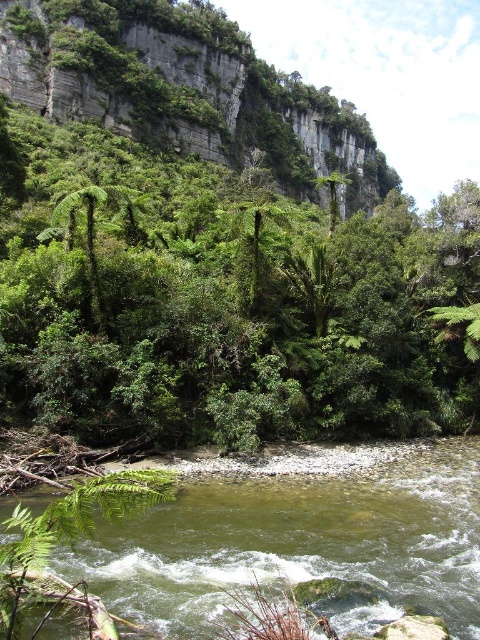
Consider the image. Can you confirm if green leafy tree at center is bigger than green smooth water at center?

Indeed, green leafy tree at center has a larger size compared to green smooth water at center.

Between point (361, 275) and point (123, 548), which one is positioned in front?

Positioned in front is point (123, 548).

Which is in front, point (39, 289) or point (312, 477)?

Point (312, 477) is in front.

I want to click on green leafy tree at center, so click(227, 307).

Can you confirm if green leafy tree at center is positioned below green leafy hillside at upper left?

Indeed, green leafy tree at center is positioned under green leafy hillside at upper left.

Between green leafy tree at center and green leafy hillside at upper left, which one appears on the left side from the viewer's perspective?

From the viewer's perspective, green leafy tree at center appears more on the left side.

This screenshot has height=640, width=480. What do you see at coordinates (227, 307) in the screenshot?
I see `green leafy tree at center` at bounding box center [227, 307].

At what (x,y) coordinates should I click in order to perform the action: click on green leafy tree at center. Please return your answer as a coordinate pair (x, y). This screenshot has width=480, height=640. Looking at the image, I should click on (227, 307).

Which of these two, green smooth water at center or green leafy hillside at upper left, stands taller?

green leafy hillside at upper left is taller.

Based on the photo, is green smooth water at center bigger than green leafy hillside at upper left?

Incorrect, green smooth water at center is not larger than green leafy hillside at upper left.

Which is behind, point (93, 545) or point (92, 77)?

Positioned behind is point (92, 77).

Where is `green smooth water at center`? green smooth water at center is located at coordinates (300, 541).